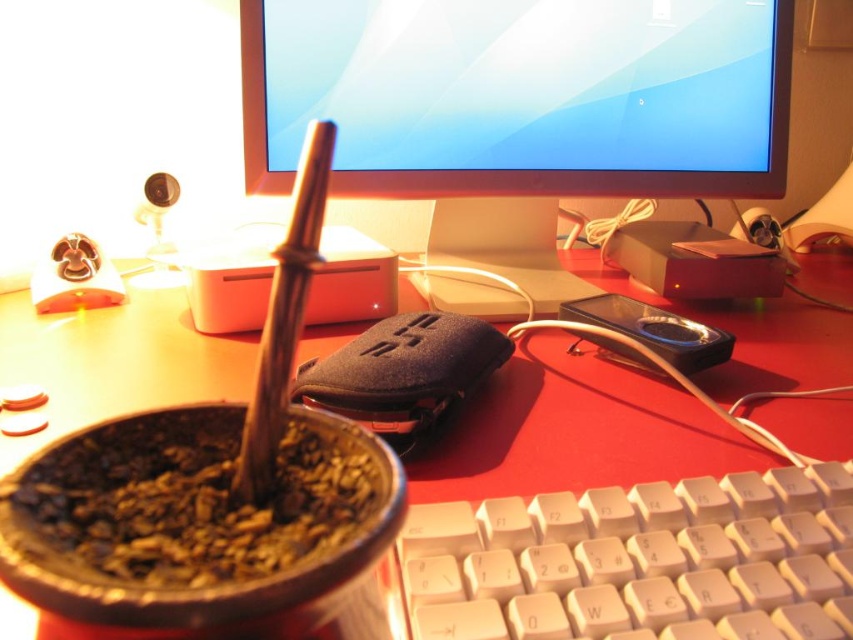
Question: Can you confirm if white plastic keyboard at lower center is wider than matte black keyboard at lower center?

Choices:
 (A) no
 (B) yes

Answer: (A)

Question: Which object is the farthest from the brown matte mate at center?

Choices:
 (A) matte black keyboard at lower center
 (B) white plastic keyboard at lower center
 (C) matte black monitor at upper center

Answer: (C)

Question: Observing the image, what is the correct spatial positioning of white plastic keyboard at lower center in reference to brown matte mate at center?

Choices:
 (A) below
 (B) above

Answer: (A)

Question: Which object is positioned closest to the matte black monitor at upper center?

Choices:
 (A) matte black keyboard at lower center
 (B) white plastic keyboard at lower center
 (C) brown matte mate at center

Answer: (A)

Question: In this image, where is matte black monitor at upper center located relative to matte black keyboard at lower center?

Choices:
 (A) above
 (B) below

Answer: (A)

Question: Which point is closer to the camera?

Choices:
 (A) (62, 362)
 (B) (4, 500)
 (C) (579, 541)
 (D) (410, 180)

Answer: (B)